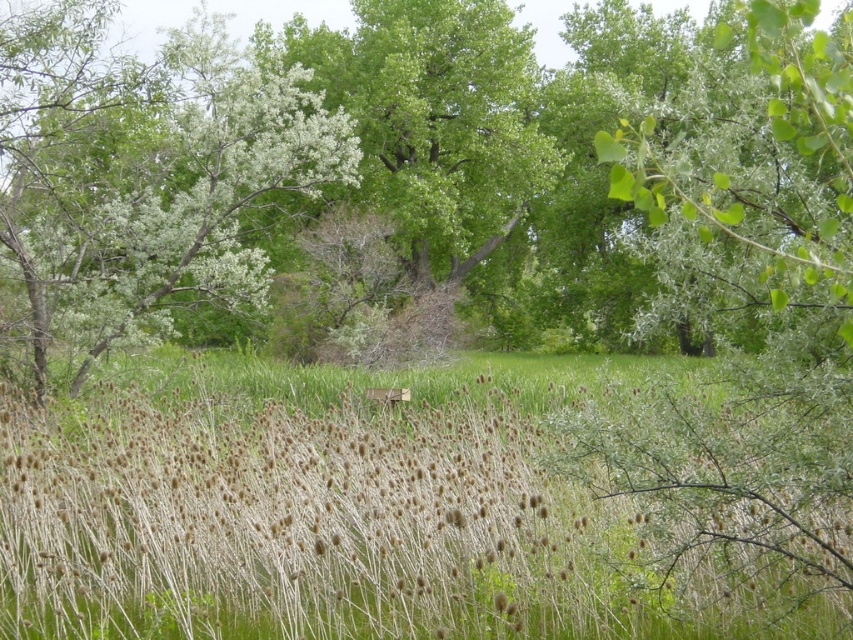
You are standing in the natural landscape and want to place a small flag at each of the two points labeled point (x=79, y=403) and point (x=221, y=230). Which point will have its flag closer to your eyes?

Point (x=79, y=403) is closer to the camera than point (x=221, y=230), so the flag placed at point (x=79, y=403) will be closer to your eyes.

You are an environmental scientist assessing the biodiversity of this landscape. You observe the green leafy tree at upper left and the green leafy tree at center. Which tree would you expect to provide more vertical space for birds to nest, and why?

The green leafy tree at upper left provides more vertical space for birds to nest because it has a greater height compared to the green leafy tree at center.

You are standing in the natural landscape and want to take a photo of both the green leafy tree at upper left and the green leafy tree at center. Which tree should you adjust your camera angle upwards to include in the frame?

You should adjust your camera angle upwards to include the green leafy tree at upper left because it is positioned above the green leafy tree at center.